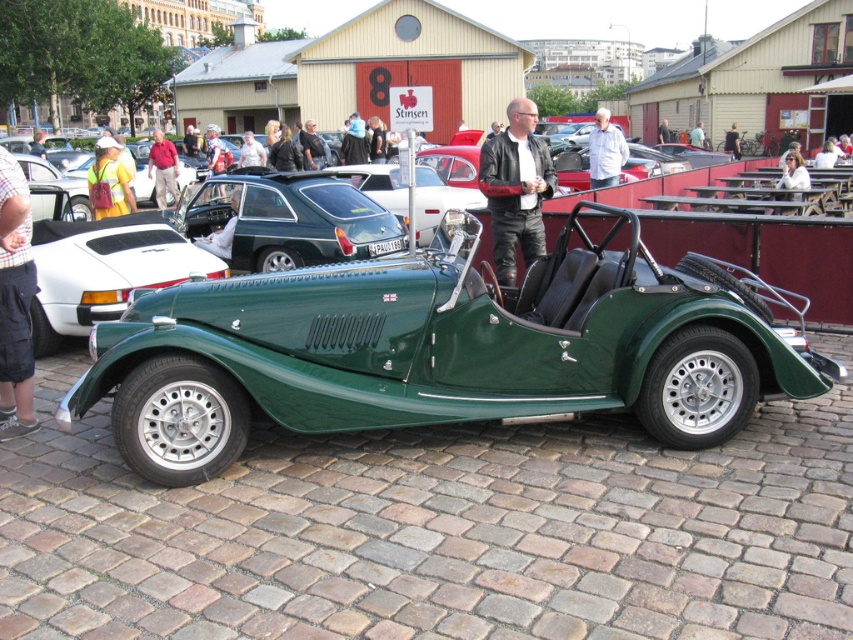
Question: Can you confirm if reflective yellow safety vest at left is positioned to the left of white leather jacket at upper center?

Choices:
 (A) yes
 (B) no

Answer: (A)

Question: Which point appears closest to the camera in this image?

Choices:
 (A) (608, 148)
 (B) (107, 189)
 (C) (506, 275)
 (D) (4, 339)

Answer: (D)

Question: Does white leather jacket at upper center lie behind dark gray leather jacket at center?

Choices:
 (A) yes
 (B) no

Answer: (B)

Question: Among these points, which one is nearest to the camera?

Choices:
 (A) (492, 252)
 (B) (679, 428)
 (C) (6, 326)
 (D) (102, 211)

Answer: (B)

Question: Does plaid shirt at left appear on the left side of dark gray leather jacket at center?

Choices:
 (A) yes
 (B) no

Answer: (B)

Question: Among these objects, which one is nearest to the camera?

Choices:
 (A) plaid shirt at left
 (B) white leather jacket at upper center

Answer: (A)